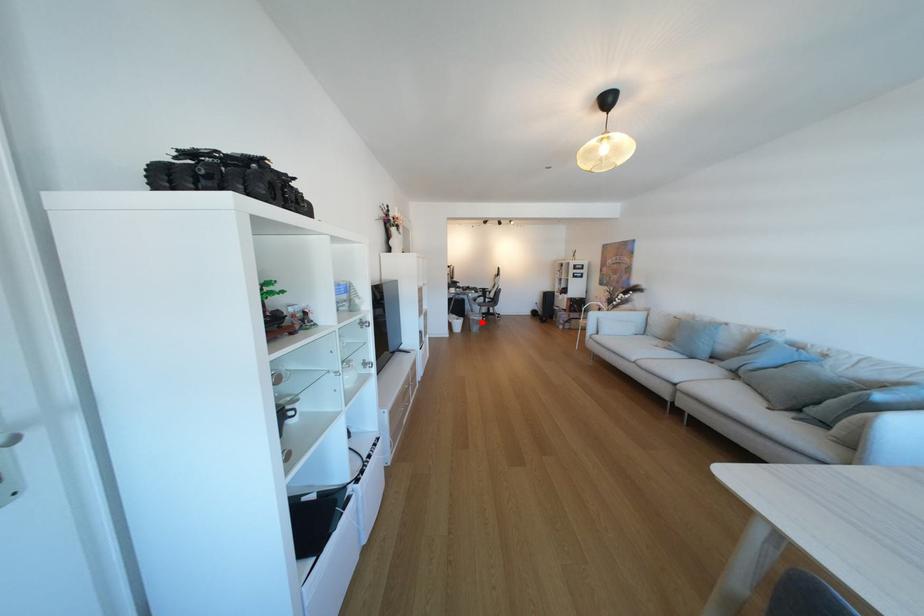
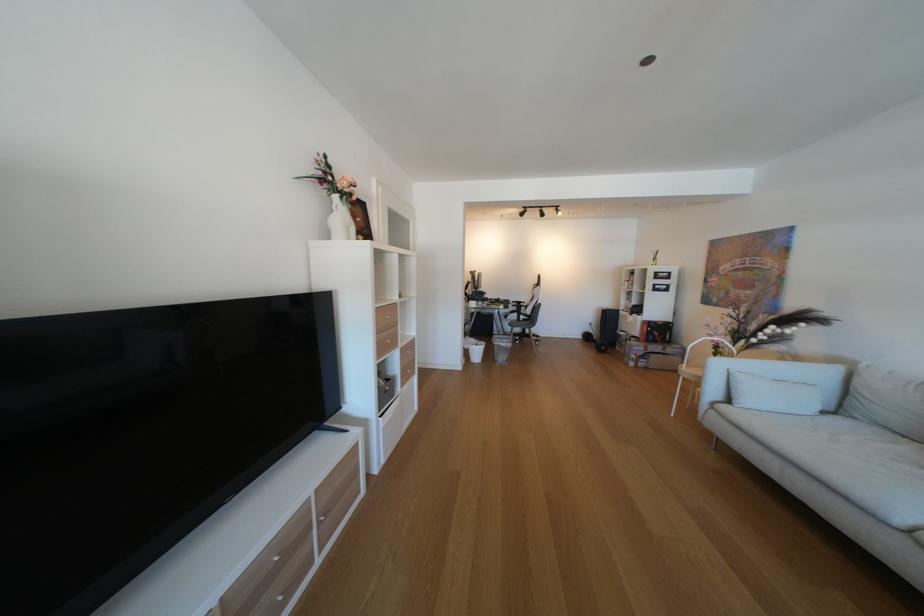
The point at the highlighted location is marked in the first image. Where is the corresponding point in the second image?

(506, 349)